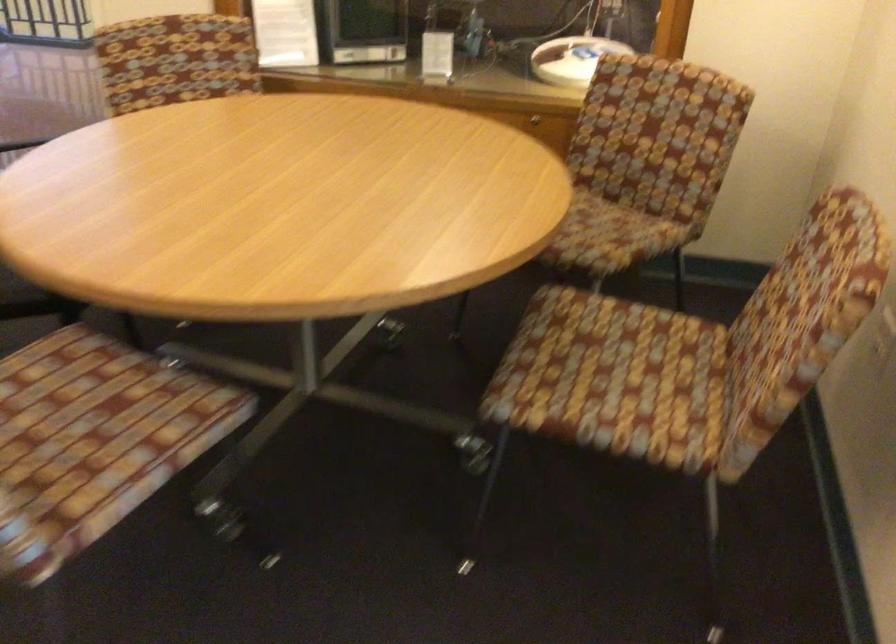
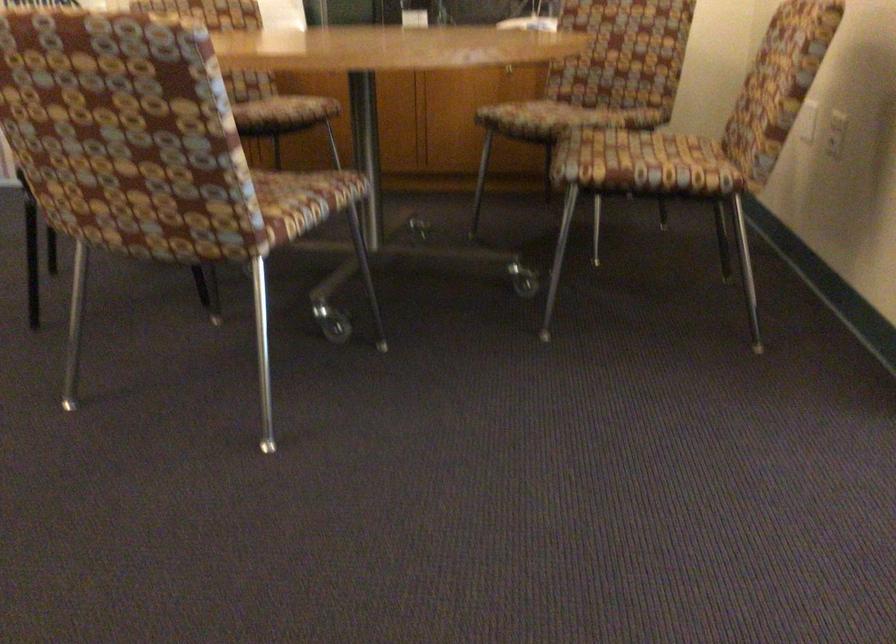
The point at (x=128, y=480) is marked in the first image. Where is the corresponding point in the second image?

(289, 204)